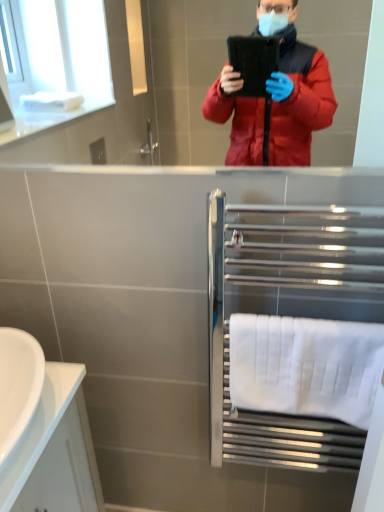
Question: From the image's perspective, is white cotton towel at lower right over polished chrome towel rack at lower right?

Choices:
 (A) yes
 (B) no

Answer: (B)

Question: Can you confirm if white cotton towel at lower right is bigger than polished chrome towel rack at lower right?

Choices:
 (A) no
 (B) yes

Answer: (A)

Question: Is there a large distance between white cotton towel at lower right and polished chrome towel rack at lower right?

Choices:
 (A) no
 (B) yes

Answer: (A)

Question: Can you see white cotton towel at lower right touching polished chrome towel rack at lower right?

Choices:
 (A) yes
 (B) no

Answer: (B)

Question: Is polished chrome towel rack at lower right located within white cotton towel at lower right?

Choices:
 (A) no
 (B) yes

Answer: (A)

Question: Considering the relative sizes of white cotton towel at lower right and polished chrome towel rack at lower right in the image provided, is white cotton towel at lower right wider than polished chrome towel rack at lower right?

Choices:
 (A) yes
 (B) no

Answer: (B)

Question: From a real-world perspective, is white glossy sink at lower left beneath polished chrome towel rack at lower right?

Choices:
 (A) no
 (B) yes

Answer: (A)

Question: Is white glossy sink at lower left closer to the viewer compared to polished chrome towel rack at lower right?

Choices:
 (A) no
 (B) yes

Answer: (B)

Question: Does white glossy sink at lower left lie behind polished chrome towel rack at lower right?

Choices:
 (A) yes
 (B) no

Answer: (B)

Question: Does white glossy sink at lower left have a greater height compared to polished chrome towel rack at lower right?

Choices:
 (A) no
 (B) yes

Answer: (A)

Question: Considering the relative positions of white glossy sink at lower left and polished chrome towel rack at lower right in the image provided, is white glossy sink at lower left to the right of polished chrome towel rack at lower right from the viewer's perspective?

Choices:
 (A) no
 (B) yes

Answer: (A)

Question: Would you consider white glossy sink at lower left to be distant from polished chrome towel rack at lower right?

Choices:
 (A) no
 (B) yes

Answer: (A)

Question: Is the surface of polished chrome towel rack at lower right in direct contact with white glossy sink at lower left?

Choices:
 (A) yes
 (B) no

Answer: (B)